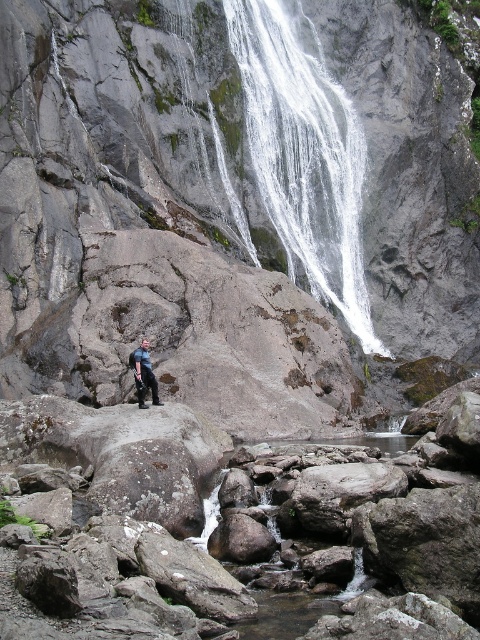
Is white frothy water at upper center above blue denim jeans at center?

Correct, white frothy water at upper center is located above blue denim jeans at center.

Who is positioned more to the right, white frothy water at upper center or blue denim jeans at center?

white frothy water at upper center

The height and width of the screenshot is (640, 480). In order to click on white frothy water at upper center in this screenshot , I will do `click(303, 156)`.

Identify the location of white frothy water at upper center. The image size is (480, 640). (303, 156).